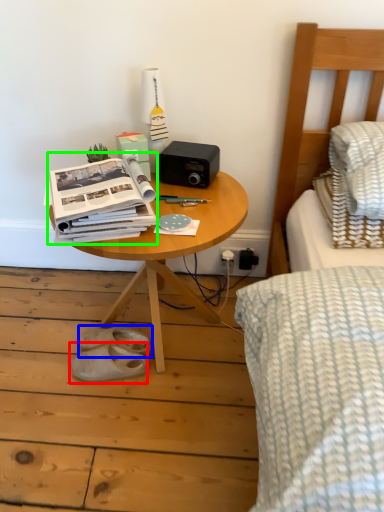
Question: Considering the real-world distances, which object is closest to footwear (highlighted by a red box)? footwear (highlighted by a blue box) or paperback book (highlighted by a green box).

Choices:
 (A) footwear
 (B) paperback book

Answer: (A)